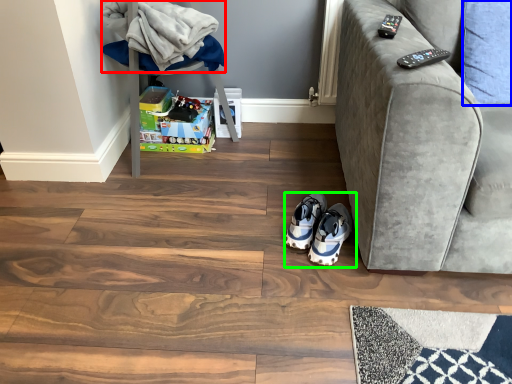
Question: Based on their relative distances, which object is farther from blanket (highlighted by a red box)? Choose from pillow (highlighted by a blue box) and footwear (highlighted by a green box).

Choices:
 (A) pillow
 (B) footwear

Answer: (A)